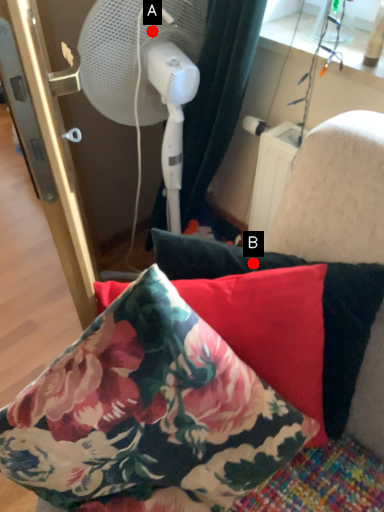
Question: Two points are circled on the image, labeled by A and B beside each circle. Among these points, which one is farthest from the camera?

Choices:
 (A) A is further
 (B) B is further

Answer: (A)